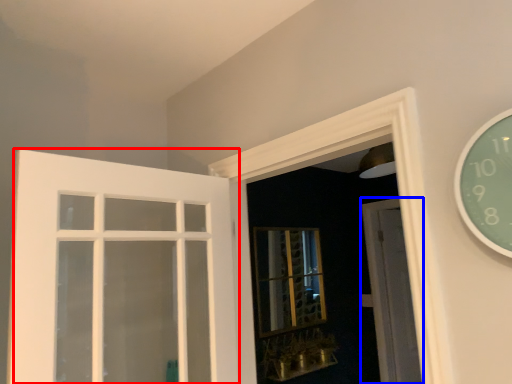
Question: Which object is further to the camera taking this photo, door (highlighted by a red box) or door (highlighted by a blue box)?

Choices:
 (A) door
 (B) door

Answer: (B)